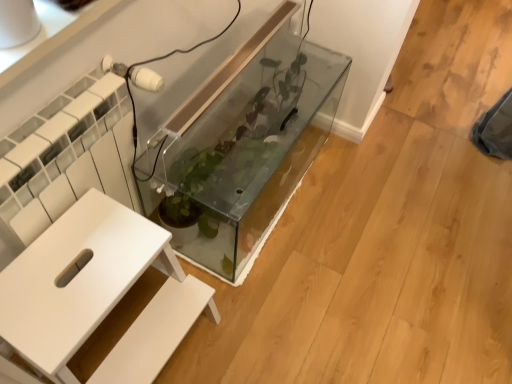
Locate an element on the screen. Image resolution: width=512 pixels, height=384 pixels. free point above white matte table at center (from a real-world perspective) is located at coordinates (79, 277).